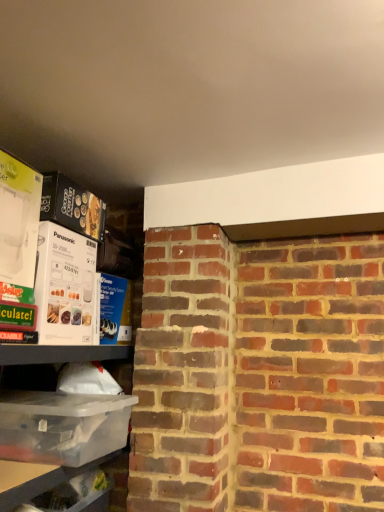
Question: Is clear plastic container at left, which appears as the first shelf when viewed from the top, surrounded by clear plastic container at lower left, arranged as the 2th shelf when viewed from the top?

Choices:
 (A) no
 (B) yes

Answer: (A)

Question: From the image's perspective, is clear plastic container at lower left, arranged as the 2th shelf when viewed from the top, beneath clear plastic container at left, which appears as the first shelf when viewed from the top?

Choices:
 (A) yes
 (B) no

Answer: (A)

Question: Is clear plastic container at left, which appears as the first shelf when viewed from the top, at the back of clear plastic container at lower left, placed as the first shelf when sorted from bottom to top?

Choices:
 (A) no
 (B) yes

Answer: (B)

Question: Considering the relative sizes of clear plastic container at lower left, arranged as the 2th shelf when viewed from the top, and clear plastic container at left, placed as the second shelf when sorted from bottom to top, in the image provided, is clear plastic container at lower left, arranged as the 2th shelf when viewed from the top, shorter than clear plastic container at left, placed as the second shelf when sorted from bottom to top,?

Choices:
 (A) no
 (B) yes

Answer: (B)

Question: Does clear plastic container at lower left, placed as the first shelf when sorted from bottom to top, have a greater width compared to clear plastic container at left, which appears as the first shelf when viewed from the top?

Choices:
 (A) no
 (B) yes

Answer: (A)

Question: Considering the positions of point 77,446 and point 112,434, is point 77,446 closer or farther from the camera than point 112,434?

Choices:
 (A) closer
 (B) farther

Answer: (A)

Question: Based on their positions, is transparent plastic container at lower left, arranged as the 1th box when ordered from the bottom, located to the left or right of clear plastic container at left, placed as the second shelf when sorted from bottom to top?

Choices:
 (A) right
 (B) left

Answer: (A)

Question: Is transparent plastic container at lower left, arranged as the 1th box when ordered from the bottom, inside the boundaries of clear plastic container at left, which appears as the first shelf when viewed from the top, or outside?

Choices:
 (A) inside
 (B) outside

Answer: (A)

Question: Is transparent plastic container at lower left, which ranks as the 3th box in top-to-bottom order, in front of or behind clear plastic container at left, which appears as the first shelf when viewed from the top, in the image?

Choices:
 (A) front
 (B) behind

Answer: (B)

Question: Considering their positions, is clear plastic container at left, placed as the second shelf when sorted from bottom to top, located in front of or behind transparent plastic container at lower left, which ranks as the 3th box in top-to-bottom order?

Choices:
 (A) front
 (B) behind

Answer: (A)

Question: Is point (x=92, y=433) closer or farther from the camera than point (x=56, y=425)?

Choices:
 (A) farther
 (B) closer

Answer: (A)

Question: Considering the positions of clear plastic container at left, placed as the second shelf when sorted from bottom to top, and transparent plastic container at lower left, arranged as the 1th box when ordered from the bottom, in the image, is clear plastic container at left, placed as the second shelf when sorted from bottom to top, wider or thinner than transparent plastic container at lower left, arranged as the 1th box when ordered from the bottom,?

Choices:
 (A) wide
 (B) thin

Answer: (B)

Question: From a real-world perspective, is clear plastic container at left, which appears as the first shelf when viewed from the top, positioned above or below transparent plastic container at lower left, arranged as the 1th box when ordered from the bottom?

Choices:
 (A) above
 (B) below

Answer: (B)

Question: Would you say white cardboard box at upper left, which is the 3th box from bottom to top, is inside or outside white cardboard box at left, the 2th box when ordered from bottom to top?

Choices:
 (A) inside
 (B) outside

Answer: (B)

Question: Based on their sizes in the image, would you say white cardboard box at upper left, which is the 3th box from bottom to top, is bigger or smaller than white cardboard box at left, acting as the second box starting from the top?

Choices:
 (A) big
 (B) small

Answer: (B)